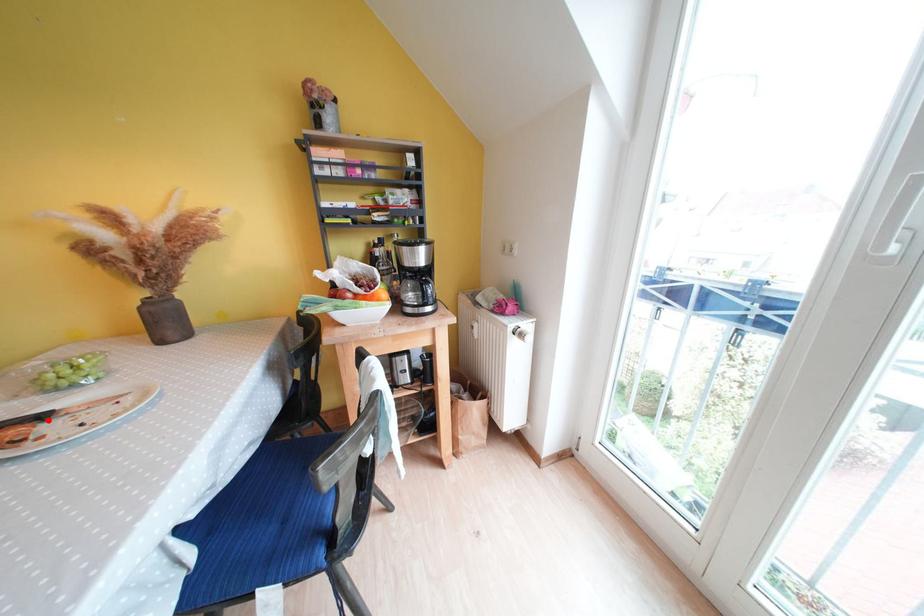
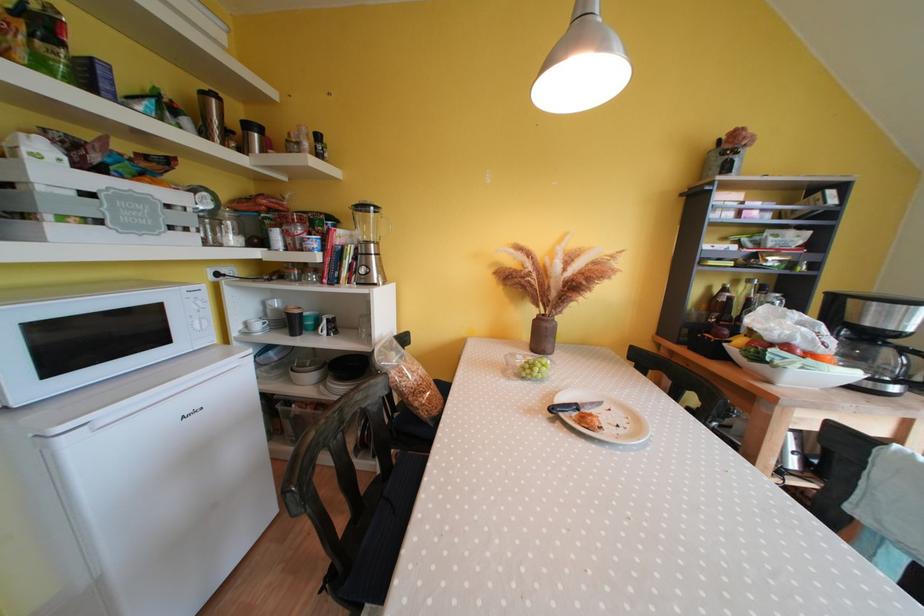
Where in the second image is the point corresponding to the highlighted location from the first image?

(582, 410)